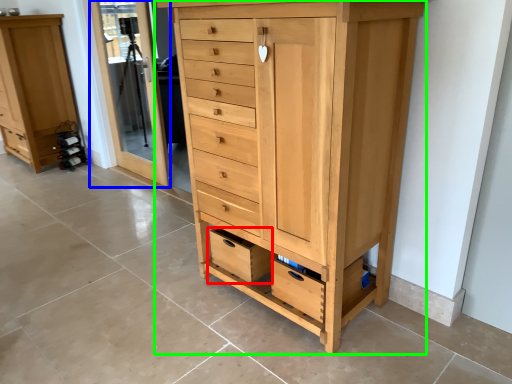
Question: Which object is the closest to the drawer (highlighted by a red box)? Choose among these: screen door (highlighted by a blue box) or chest of drawers (highlighted by a green box).

Choices:
 (A) screen door
 (B) chest of drawers

Answer: (B)